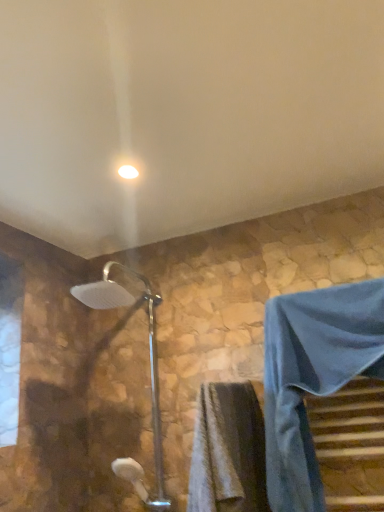
Question: Is gray textured towel at lower center turned away from silver metallic shower head at center?

Choices:
 (A) yes
 (B) no

Answer: (A)

Question: From a real-world perspective, is gray textured towel at lower center physically below silver metallic shower head at center?

Choices:
 (A) yes
 (B) no

Answer: (A)

Question: Can silver metallic shower head at center be found inside gray textured towel at lower center?

Choices:
 (A) yes
 (B) no

Answer: (B)

Question: Is gray textured towel at lower center further to camera compared to silver metallic shower head at center?

Choices:
 (A) no
 (B) yes

Answer: (A)

Question: Can you confirm if gray textured towel at lower center is positioned to the right of silver metallic shower head at center?

Choices:
 (A) yes
 (B) no

Answer: (A)

Question: Could you tell me if gray textured towel at lower center is facing silver metallic shower head at center?

Choices:
 (A) no
 (B) yes

Answer: (A)

Question: Are white glossy light fixture at upper center and blue fabric robe at lower right beside each other?

Choices:
 (A) no
 (B) yes

Answer: (A)

Question: From a real-world perspective, is white glossy light fixture at upper center over blue fabric robe at lower right?

Choices:
 (A) no
 (B) yes

Answer: (B)

Question: Is white glossy light fixture at upper center oriented towards blue fabric robe at lower right?

Choices:
 (A) yes
 (B) no

Answer: (B)

Question: Is white glossy light fixture at upper center smaller than blue fabric robe at lower right?

Choices:
 (A) no
 (B) yes

Answer: (B)

Question: Considering the relative sizes of white glossy light fixture at upper center and blue fabric robe at lower right in the image provided, is white glossy light fixture at upper center bigger than blue fabric robe at lower right?

Choices:
 (A) yes
 (B) no

Answer: (B)

Question: From the image's perspective, is white glossy light fixture at upper center beneath blue fabric robe at lower right?

Choices:
 (A) yes
 (B) no

Answer: (B)

Question: Is silver metallic shower head at center in contact with gray textured towel at lower center?

Choices:
 (A) no
 (B) yes

Answer: (A)